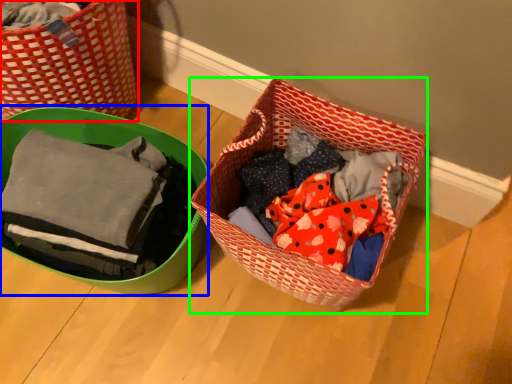
Question: Which object is positioned closest to picnic basket (highlighted by a red box)? Select from gift basket (highlighted by a blue box) and picnic basket (highlighted by a green box).

Choices:
 (A) gift basket
 (B) picnic basket

Answer: (A)